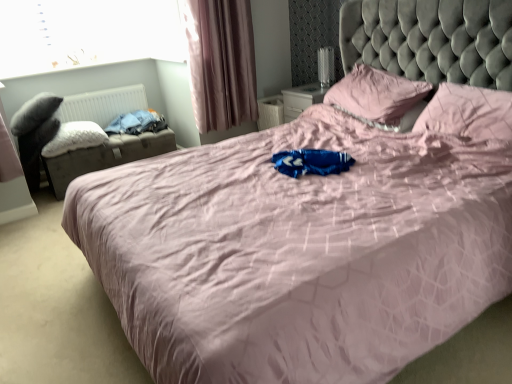
Question: In terms of width, does transparent glass window at upper left look wider or thinner when compared to white fluffy pillow at left, the 1th pillow viewed from the left?

Choices:
 (A) wide
 (B) thin

Answer: (B)

Question: Is transparent glass window at upper left spatially inside white fluffy pillow at left, the 1th pillow viewed from the left, or outside of it?

Choices:
 (A) inside
 (B) outside

Answer: (B)

Question: Which object is the closest to the transparent glass window at upper left?

Choices:
 (A) velvet black swivel chair at left
 (B) leatherette storage ottoman at left
 (C) white fluffy pillow at left, placed as the 3th pillow when sorted from right to left
 (D) pink fabric curtain at upper left
 (E) white plastic radiator at left

Answer: (E)

Question: Estimate the real-world distances between objects in this image. Which object is farther from the blue cotton clothes at left?

Choices:
 (A) leatherette storage ottoman at left
 (B) transparent glass window at upper left
 (C) pink fabric pillow at upper center, the second pillow in the right-to-left sequence
 (D) white plastic radiator at left
 (E) white fluffy pillow at left, the 1th pillow viewed from the left

Answer: (C)